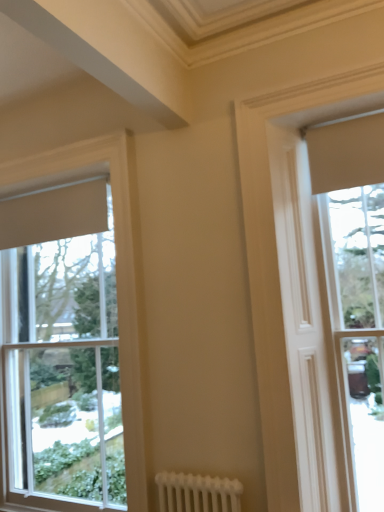
Question: Is white wood window at left, marked as the 3th window in a right-to-left arrangement, positioned in front of matte beige curtain at right, the 1th window viewed from the right?

Choices:
 (A) no
 (B) yes

Answer: (A)

Question: Does white wood window at left, which ranks as the 1th window in left-to-right order, have a greater height compared to matte beige curtain at right, placed as the 3th window when sorted from left to right?

Choices:
 (A) no
 (B) yes

Answer: (B)

Question: Considering the relative positions of white wood window at left, which ranks as the 1th window in left-to-right order, and matte beige curtain at right, placed as the 3th window when sorted from left to right, in the image provided, is white wood window at left, which ranks as the 1th window in left-to-right order, behind matte beige curtain at right, placed as the 3th window when sorted from left to right,?

Choices:
 (A) no
 (B) yes

Answer: (B)

Question: Can you confirm if white wood window at left, which ranks as the 1th window in left-to-right order, is smaller than matte beige curtain at right, placed as the 3th window when sorted from left to right?

Choices:
 (A) yes
 (B) no

Answer: (B)

Question: Does white wood window at left, marked as the 3th window in a right-to-left arrangement, touch matte beige curtain at right, the 1th window viewed from the right?

Choices:
 (A) no
 (B) yes

Answer: (A)

Question: Does point (339, 301) appear closer or farther from the camera than point (279, 413)?

Choices:
 (A) farther
 (B) closer

Answer: (A)

Question: Based on their positions, is matte beige curtain at right, the 1th window viewed from the right, located to the left or right of matte beige window at upper right, which is the 2th window from right to left?

Choices:
 (A) right
 (B) left

Answer: (A)

Question: Choose the correct answer: Is matte beige curtain at right, the 1th window viewed from the right, inside matte beige window at upper right, the second window when ordered from left to right, or outside it?

Choices:
 (A) inside
 (B) outside

Answer: (B)

Question: In terms of height, does matte beige curtain at right, placed as the 3th window when sorted from left to right, look taller or shorter compared to matte beige window at upper right, which is the 2th window from right to left?

Choices:
 (A) tall
 (B) short

Answer: (B)

Question: Considering the positions of matte beige curtain at right, the 1th window viewed from the right, and white wood window at left, which ranks as the 1th window in left-to-right order, in the image, is matte beige curtain at right, the 1th window viewed from the right, wider or thinner than white wood window at left, which ranks as the 1th window in left-to-right order,?

Choices:
 (A) thin
 (B) wide

Answer: (B)

Question: Is point (377, 392) positioned closer to the camera than point (117, 268)?

Choices:
 (A) closer
 (B) farther

Answer: (A)

Question: Relative to white wood window at left, marked as the 3th window in a right-to-left arrangement, is matte beige curtain at right, placed as the 3th window when sorted from left to right, in front or behind?

Choices:
 (A) front
 (B) behind

Answer: (A)

Question: From a real-world perspective, relative to white wood window at left, marked as the 3th window in a right-to-left arrangement, is matte beige curtain at right, the 1th window viewed from the right, vertically above or below?

Choices:
 (A) below
 (B) above

Answer: (A)

Question: Considering the positions of matte beige window at upper right, the second window when ordered from left to right, and matte beige curtain at right, the 1th window viewed from the right, in the image, is matte beige window at upper right, the second window when ordered from left to right, bigger or smaller than matte beige curtain at right, the 1th window viewed from the right,?

Choices:
 (A) small
 (B) big

Answer: (A)

Question: Do you think matte beige window at upper right, which is the 2th window from right to left, is within matte beige curtain at right, the 1th window viewed from the right, or outside of it?

Choices:
 (A) inside
 (B) outside

Answer: (B)